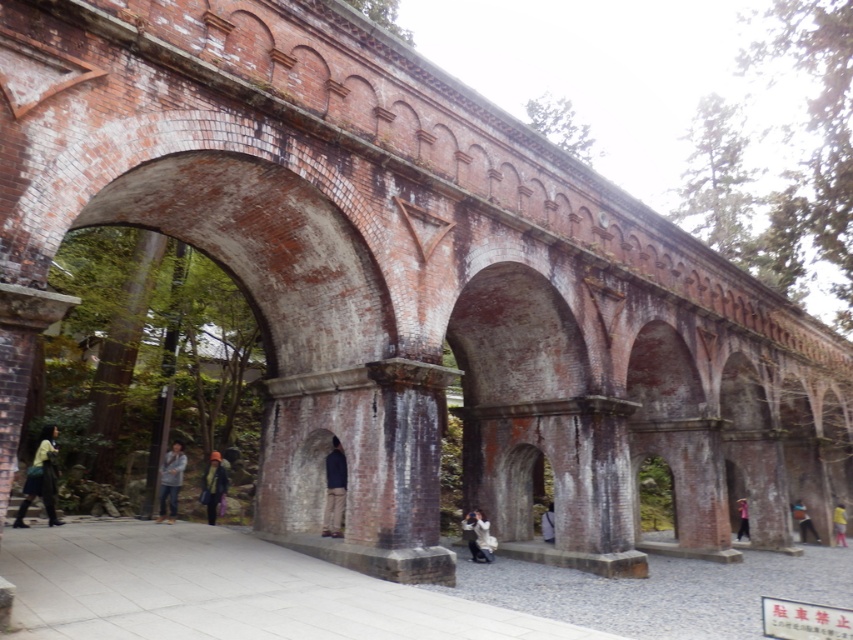
You are an event planner setting up decorations for a garden party. You have two fabrics, the white fabric at center and the pink fabric at lower right. Which fabric should you choose if you need a longer one to cover a large table?

The pink fabric at lower right is longer than the white fabric at center, so you should choose the pink fabric at lower right to cover the large table.

You are standing in front of the historic brick archway and notice a white fabric at center and a light brown leather jacket at center. Which object is nearer to you?

The white fabric at center is closer to the viewer than the light brown leather jacket at center.

You are a photographer planning to take a photo of the historic brick archway structure. You have a white fabric at center and a pink fabric at lower right that you want to include in the frame. Given that your camera has a maximum focus range of 40 meters, will both fabrics be in focus at the same time?

The white fabric at center and pink fabric at lower right are 41.54 meters apart from each other, which exceeds the camera maximum focus range of 40 meters. Therefore, both fabrics cannot be in focus simultaneously.